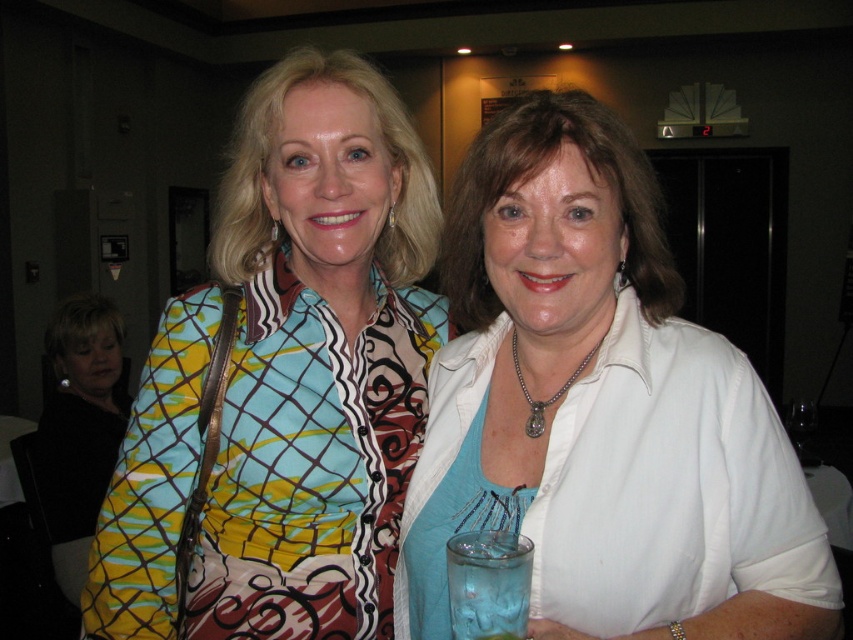
You are at a party and see two women standing together. The woman on the left is wearing a white glossy shirt at center, and the woman on the right is wearing a printed fabric blouse at center. Which clothing item is positioned lower on the body?

The white glossy shirt at center is located below the printed fabric blouse at center, so the white glossy shirt at center is positioned lower on the body.